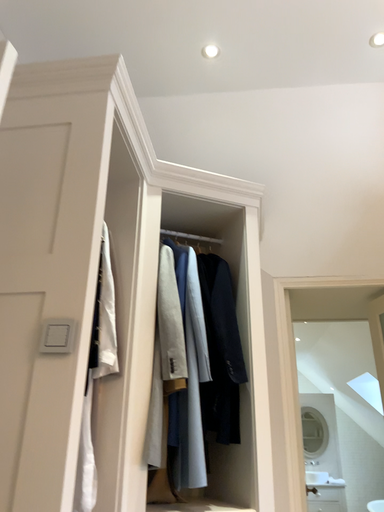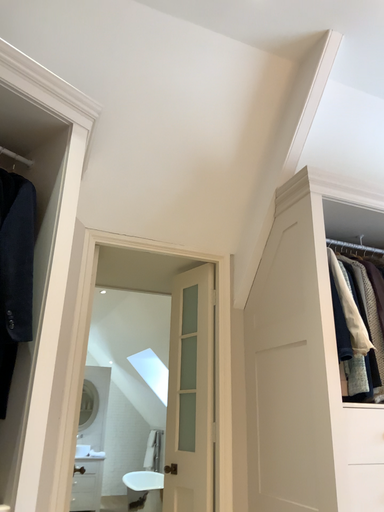
Question: How did the camera likely rotate when shooting the video?

Choices:
 (A) rotated right
 (B) rotated left

Answer: (A)